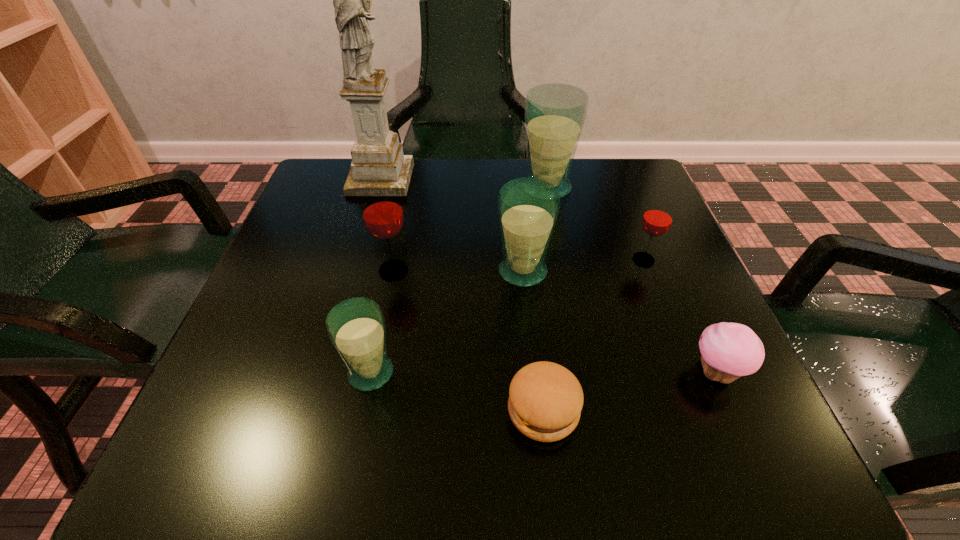
Where is `the second shortest object`? the second shortest object is located at coordinates [728, 351].

This screenshot has width=960, height=540. In order to click on pink cupcake in this screenshot , I will do `click(728, 351)`.

I want to click on hamburger, so click(545, 401).

Identify the location of the shortest object. (545, 401).

You are a GUI agent. You are given a task and a screenshot of the screen. Output one action in this format:
    pyautogui.click(x=<x>, y=<y>)
    Task: Click on the vacant region located on the front-facing side of the gray sculpture
    
    Given the screenshot: What is the action you would take?
    pyautogui.click(x=471, y=179)

At what (x,y) coordinates should I click in order to perform the action: click on free region located on the left of the tallest glass. Please return your answer as a coordinate pair (x, y). The height and width of the screenshot is (540, 960). Looking at the image, I should click on (398, 188).

Identify the location of free location located 0.110m on the left of the bigger red glass. (319, 271).

Where is `free space located on the front of the second nearest blue glass`? free space located on the front of the second nearest blue glass is located at coordinates (529, 334).

Image resolution: width=960 pixels, height=540 pixels. In order to click on vacant space located on the back of the right red glass in this screenshot , I will do `click(628, 218)`.

You are a GUI agent. You are given a task and a screenshot of the screen. Output one action in this format:
    pyautogui.click(x=<x>, y=<y>)
    Task: Click on the vacant region located 0.160m on the left of the smallest blue glass
    The image size is (960, 540).
    Given the screenshot: What is the action you would take?
    pyautogui.click(x=245, y=373)